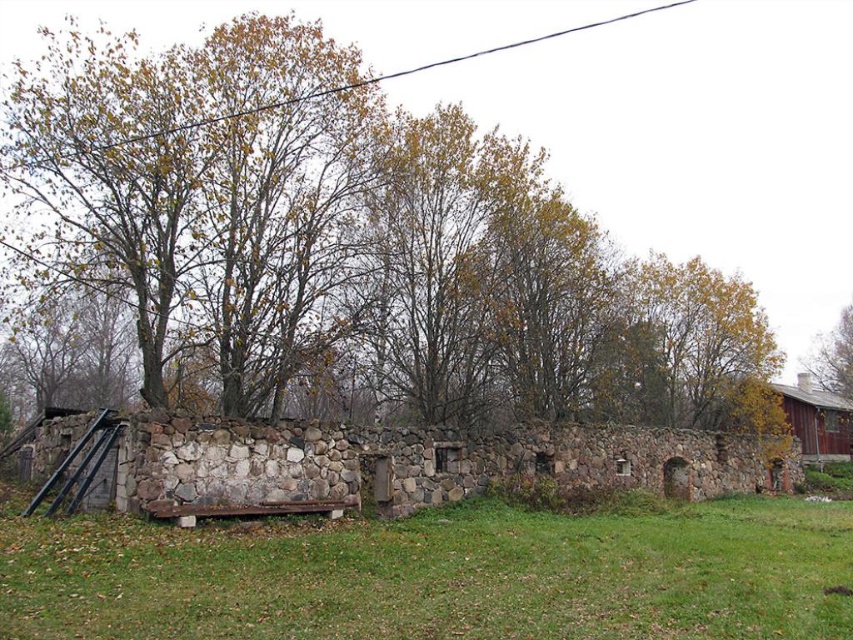
In the scene shown: You are standing in front of the stone wall and notice the brown leafy tree at upper left and the green grass at lower center. Which object is positioned higher in the image?

The brown leafy tree at upper left is above the green grass at lower center, so it is positioned higher in the image.

You are standing at the point marked by point [439,576]. Looking around, you see the stone wall structure in the foreground and the wooden bench on the grassy ground. Which direction should you walk to reach the wooden bench?

The point [439,576] is marked as green grass at lower center, so you should walk forward towards the wooden bench located on the grassy ground in front of you.

You are standing in front of the stone wall and notice the green grass at lower center and the brown leafy tree at upper right. Which of these two objects occupies a larger area in the image?

The green grass at lower center occupies a larger area than the brown leafy tree at upper right because its width surpasses that of the tree.